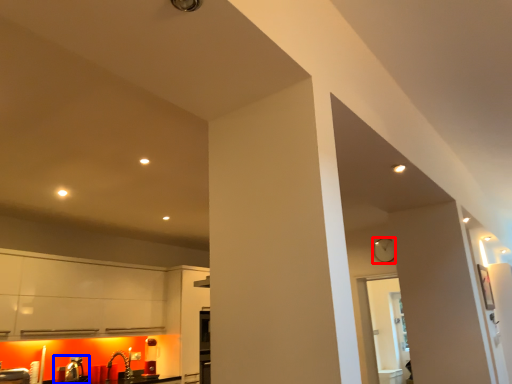
Question: Which object is closer to the camera taking this photo, clock (highlighted by a red box) or sink (highlighted by a blue box)?

Choices:
 (A) clock
 (B) sink

Answer: (B)